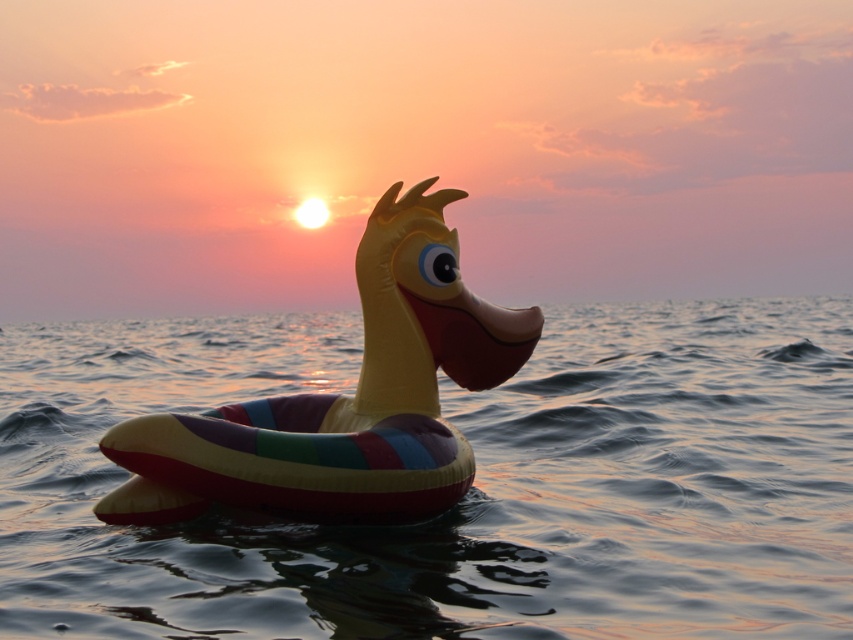
Question: Which object is farther from the camera taking this photo?

Choices:
 (A) translucent plastic water at center
 (B) rubber duck at center

Answer: (B)

Question: Which object appears closest to the camera in this image?

Choices:
 (A) translucent plastic water at center
 (B) rubber duck at center

Answer: (A)

Question: Can you confirm if translucent plastic water at center is bigger than rubber duck at center?

Choices:
 (A) no
 (B) yes

Answer: (B)

Question: Observing the image, what is the correct spatial positioning of translucent plastic water at center in reference to rubber duck at center?

Choices:
 (A) left
 (B) right

Answer: (B)

Question: Is translucent plastic water at center above rubber duck at center?

Choices:
 (A) no
 (B) yes

Answer: (B)